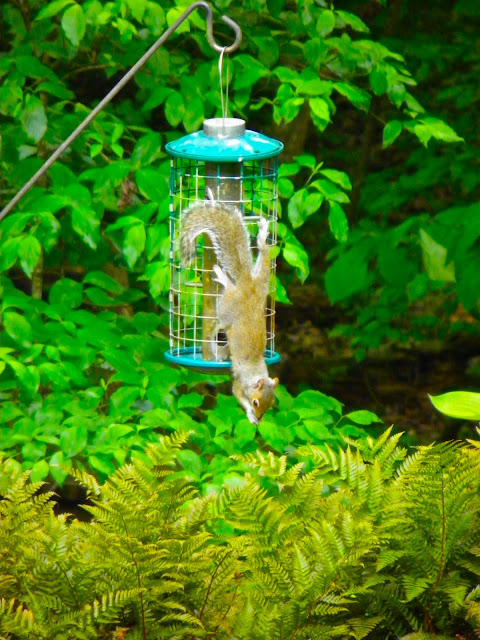
This screenshot has width=480, height=640. I want to click on hook, so click(235, 29).